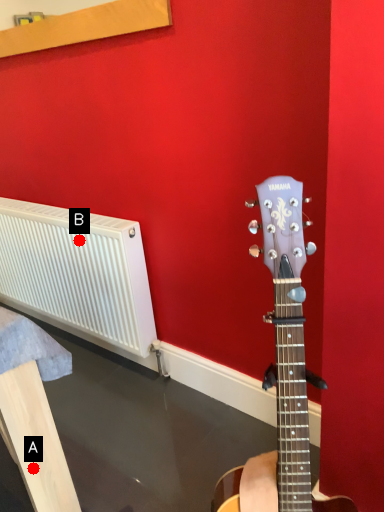
Question: Two points are circled on the image, labeled by A and B beside each circle. Which point is closer to the camera?

Choices:
 (A) A is closer
 (B) B is closer

Answer: (A)